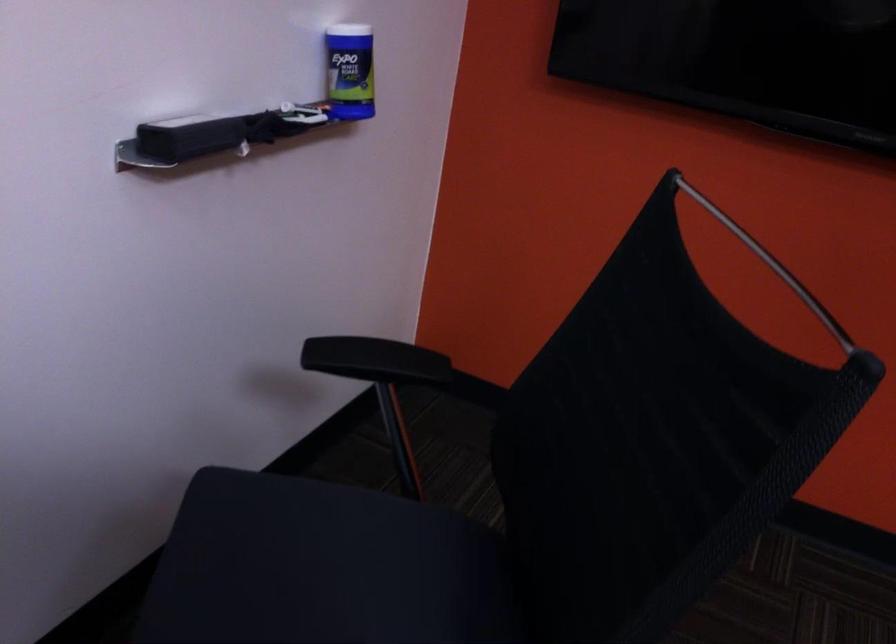
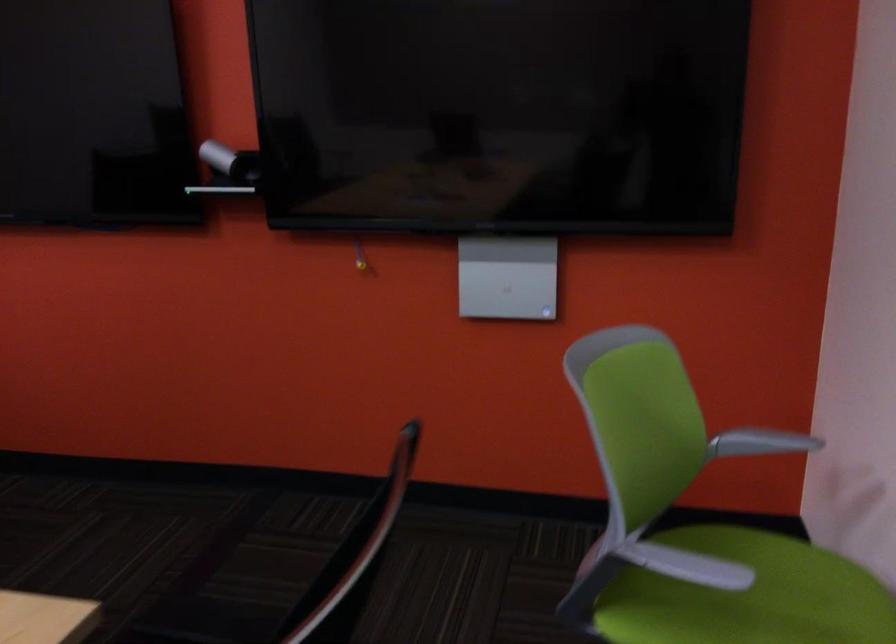
The images are taken continuously from a first-person perspective. In which direction are you moving?

The cameraman moved toward right, backward.